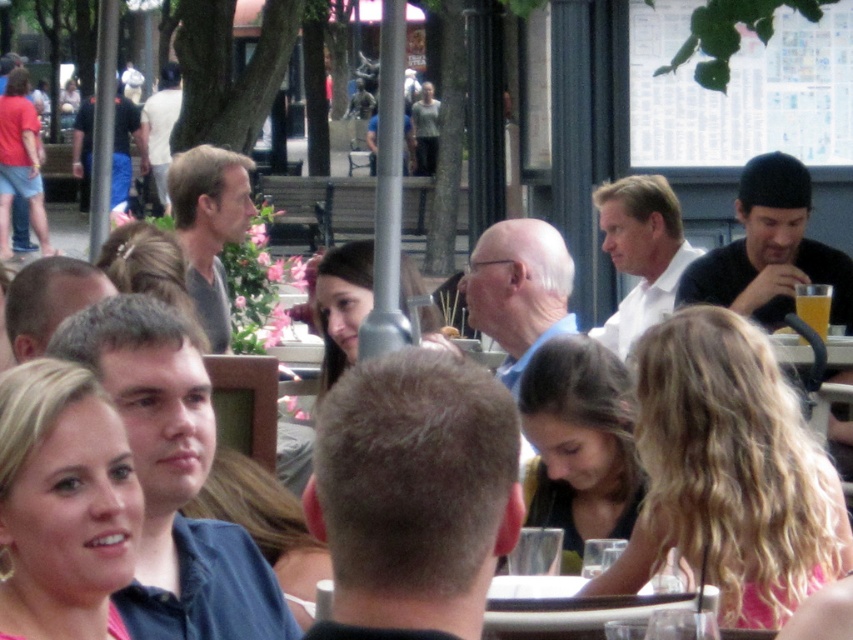
You are a photographer trying to capture a clear shot of both the blonde curly hair at center and the blonde hair at center. Since you want to ensure both are visible in the frame, which hairstyle do you need to adjust the camera focus on to account for their size difference?

The blonde curly hair at center is wider than the blonde hair at center, so you should focus on the wider one to ensure both are visible.

You are a photographer taking a picture of the dark brown hair at center and the translucent glass beverage at upper right. Which object should you focus on first if you want to capture both clearly in your photo?

You should focus on the dark brown hair at center first because it is wider than the translucent glass beverage at upper right, ensuring it is in sharp focus while the beverage may still be acceptably clear depending on depth of field.